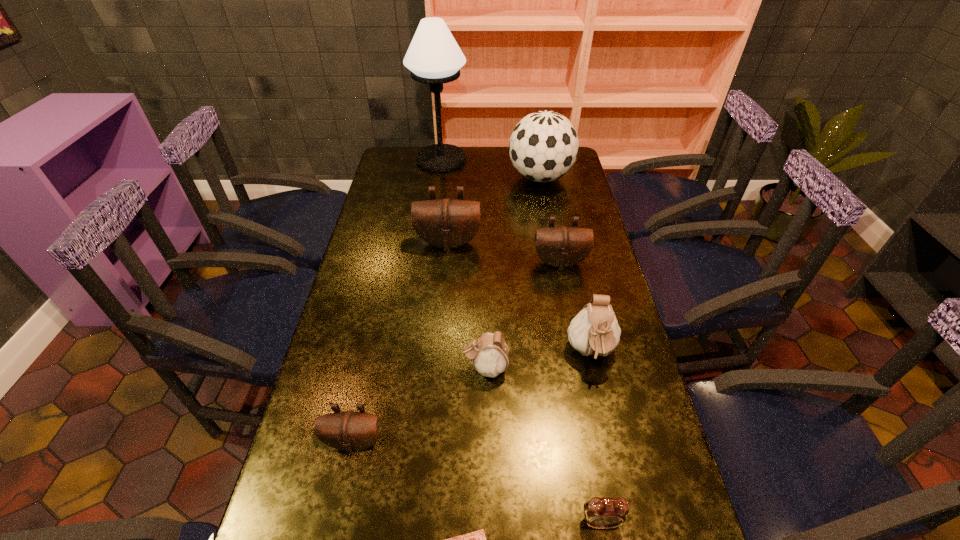
Locate an element on the screen. The height and width of the screenshot is (540, 960). table lamp at the far edge is located at coordinates (433, 57).

You are a GUI agent. You are given a task and a screenshot of the screen. Output one action in this format:
    pyautogui.click(x=<x>, y=<y>)
    Task: Click on the soccer ball at the far edge
    The height and width of the screenshot is (540, 960).
    Given the screenshot: What is the action you would take?
    pyautogui.click(x=543, y=147)

Identify the location of table lamp that is at the left edge. The image size is (960, 540). (433, 57).

The height and width of the screenshot is (540, 960). I want to click on pouch located at the left edge, so click(x=349, y=431).

I want to click on soccer ball at the right edge, so click(543, 147).

Identify the location of alarm clock situated at the right edge. (602, 513).

Where is `object that is positioned at the far left corner`? The width and height of the screenshot is (960, 540). object that is positioned at the far left corner is located at coordinates pos(433,57).

Locate an element on the screen. The width and height of the screenshot is (960, 540). object located at the far right corner is located at coordinates (543, 147).

Find the location of a particular element. free point at the far edge is located at coordinates (476, 152).

Where is `vacant space at the left edge of the desktop`? Image resolution: width=960 pixels, height=540 pixels. vacant space at the left edge of the desktop is located at coordinates (385, 180).